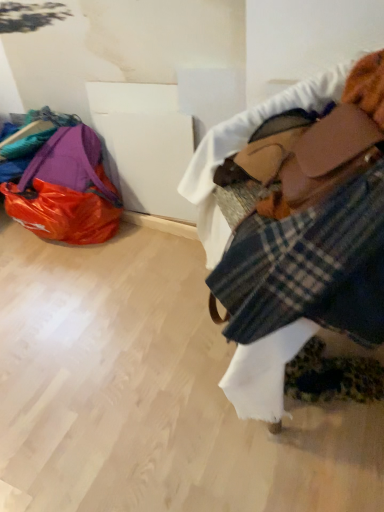
Identify the location of matte purple bag at left. (66, 191).

Find the location of `plaid fabric at right`. plaid fabric at right is located at coordinates (309, 266).

Can you tell me how much plaid fabric at upper right and plaid fabric at right differ in facing direction?

The angle between the facing direction of plaid fabric at upper right and the facing direction of plaid fabric at right is 17.8 degrees.

Which of these two, plaid fabric at upper right or plaid fabric at right, stands taller?

With more height is plaid fabric at upper right.

Looking at this image, is plaid fabric at upper right positioned with its back to plaid fabric at right?

That's right, plaid fabric at upper right is facing away from plaid fabric at right.

Is plaid fabric at upper right with plaid fabric at right?

Indeed, plaid fabric at upper right and plaid fabric at right are beside each other and touching.

Considering the sizes of objects plaid fabric at right and plaid fabric at upper right in the image provided, who is shorter, plaid fabric at right or plaid fabric at upper right?

With less height is plaid fabric at right.

Considering the positions of points (322, 286) and (375, 132), is point (322, 286) farther from camera compared to point (375, 132)?

No, it is in front of (375, 132).

Which object is thinner, plaid fabric at right or plaid fabric at upper right?

Thinner between the two is plaid fabric at right.

From a real-world perspective, is plaid fabric at right positioned under plaid fabric at upper right based on gravity?

No.

Between matte purple bag at left and plaid fabric at right, which one appears on the left side from the viewer's perspective?

From the viewer's perspective, matte purple bag at left appears more on the left side.

Does point (68, 134) come behind point (294, 318)?

Yes.

From the image's perspective, is matte purple bag at left on top of plaid fabric at right?

Yes, from the image's perspective, matte purple bag at left is above plaid fabric at right.

Is matte purple bag at left positioned beyond the bounds of plaid fabric at right?

matte purple bag at left is positioned outside plaid fabric at right.

Is point (282, 111) positioned after point (109, 212)?

No, (282, 111) is in front of (109, 212).

How distant is plaid fabric at upper right from matte purple bag at left?

plaid fabric at upper right and matte purple bag at left are 36.90 inches apart.

Is plaid fabric at upper right far away from matte purple bag at left?

No, plaid fabric at upper right is not far away from matte purple bag at left.

In the scene shown: In terms of width, does plaid fabric at upper right look wider or thinner when compared to matte purple bag at left?

Considering their sizes, plaid fabric at upper right looks broader than matte purple bag at left.

Considering the relative positions of matte purple bag at left and plaid fabric at upper right in the image provided, is matte purple bag at left to the right of plaid fabric at upper right from the viewer's perspective?

No, matte purple bag at left is not to the right of plaid fabric at upper right.

Consider the image. Would you say matte purple bag at left is a long distance from plaid fabric at upper right?

They are positioned close to each other.

Considering the relative sizes of matte purple bag at left and plaid fabric at upper right in the image provided, is matte purple bag at left smaller than plaid fabric at upper right?

Indeed, matte purple bag at left has a smaller size compared to plaid fabric at upper right.

You are a GUI agent. You are given a task and a screenshot of the screen. Output one action in this format:
    pyautogui.click(x=<x>, y=<y>)
    Task: Click on the luggage and bags that is behind the plaid fabric at right
    
    Given the screenshot: What is the action you would take?
    pyautogui.click(x=66, y=191)

Can you confirm if plaid fabric at right is positioned to the left of matte purple bag at left?

No.

Considering the relative sizes of plaid fabric at right and matte purple bag at left in the image provided, is plaid fabric at right smaller than matte purple bag at left?

Yes.

From a real-world perspective, is plaid fabric at right positioned under matte purple bag at left based on gravity?

No, from a real-world perspective, plaid fabric at right is not beneath matte purple bag at left.

Where is `flannel that appears on the left of plaid fabric at upper right`? This screenshot has width=384, height=512. flannel that appears on the left of plaid fabric at upper right is located at coordinates (309, 266).

The height and width of the screenshot is (512, 384). What are the coordinates of `textile lying on the right of plaid fabric at right` in the screenshot? It's located at (299, 233).

Based on their spatial positions, is plaid fabric at upper right or matte purple bag at left further from plaid fabric at right?

The object further to plaid fabric at right is matte purple bag at left.

Which object lies further to the anchor point matte purple bag at left, plaid fabric at right or plaid fabric at upper right?

Based on the image, plaid fabric at right appears to be further to matte purple bag at left.

Looking at this image, from the image, which object appears to be nearer to plaid fabric at upper right, plaid fabric at right or matte purple bag at left?

The object closer to plaid fabric at upper right is plaid fabric at right.

Which object lies further to the anchor point plaid fabric at right, matte purple bag at left or plaid fabric at upper right?

The object further to plaid fabric at right is matte purple bag at left.

Based on their spatial positions, is plaid fabric at upper right or plaid fabric at right further from matte purple bag at left?

plaid fabric at right is positioned further to the anchor matte purple bag at left.

Estimate the real-world distances between objects in this image. Which object is closer to plaid fabric at upper right, matte purple bag at left or plaid fabric at right?

plaid fabric at right is positioned closer to the anchor plaid fabric at upper right.

Find the location of a particular element. flannel between plaid fabric at upper right and matte purple bag at left along the z-axis is located at coordinates (309, 266).